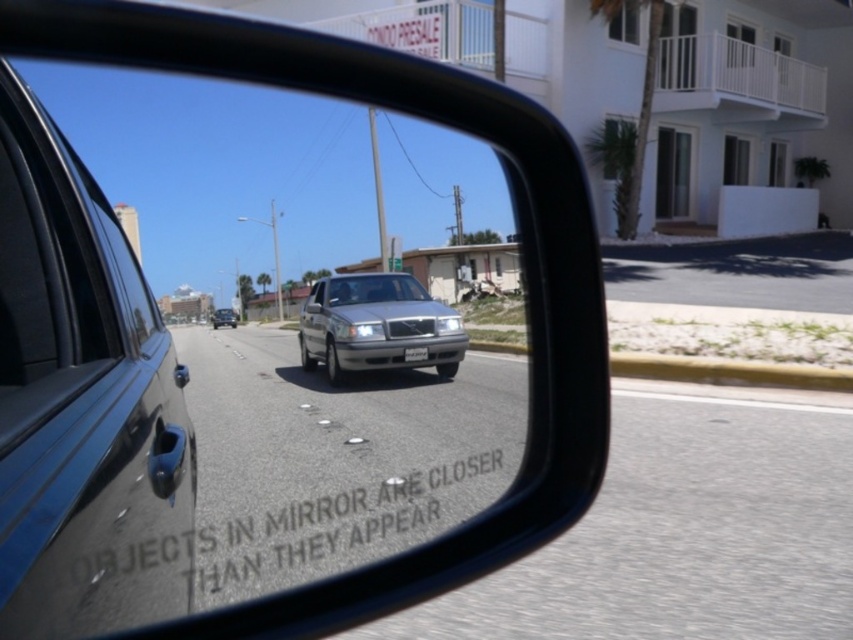
Question: Estimate the real-world distances between objects in this image. Which object is closer to the silver metallic sedan at center?

Choices:
 (A) black plastic mirror at center
 (B) satin silver sedan at center

Answer: (A)

Question: Which object is closer to the camera taking this photo?

Choices:
 (A) satin silver sedan at center
 (B) silver metallic sedan at center
 (C) black plastic mirror at center

Answer: (C)

Question: Is satin silver sedan at center smaller than silver metallic sedan at center?

Choices:
 (A) yes
 (B) no

Answer: (A)

Question: Estimate the real-world distances between objects in this image. Which object is farther from the satin silver sedan at center?

Choices:
 (A) black plastic mirror at center
 (B) silver metallic sedan at center

Answer: (B)

Question: Is black plastic mirror at center smaller than satin silver sedan at center?

Choices:
 (A) yes
 (B) no

Answer: (B)

Question: Does black plastic mirror at center have a larger size compared to silver metallic sedan at center?

Choices:
 (A) yes
 (B) no

Answer: (A)